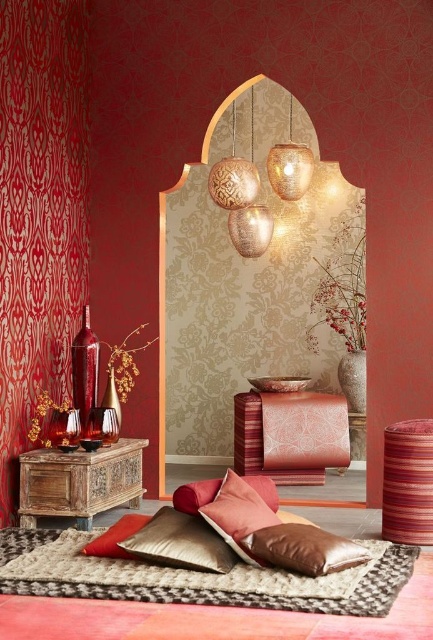
You are standing in the room and want to move from the striped fabric stool at lower right to the textured brass lamp at upper center. Which direction should you move to reach it?

You should move to the left to reach the textured brass lamp at upper center because the striped fabric stool at lower right is to the right of the textured brass lamp at upper center.

You are a delivery person who needs to place a package on the floor between the striped fabric stool at lower right and the textured brass lamp at upper center. The package requires 6 feet of space to fit. Is there enough space between them?

The distance between the striped fabric stool at lower right and the textured brass lamp at upper center is 7.51 feet, which is more than the required 6 feet. Therefore, there is sufficient space to place the package between them.

You are an interior designer assessing the space. You need to determine which object between the red velvet curtain at left and the velvet cushion at lower center is taller. Which one is taller?

The red velvet curtain at left has a greater height compared to the velvet cushion at lower center, so the red velvet curtain at left is taller.